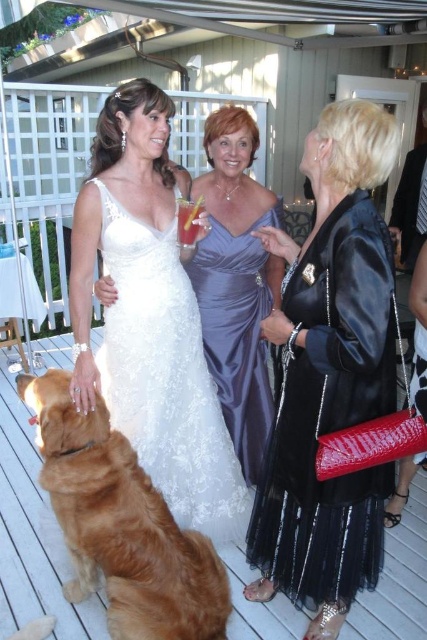
Is black satin clutch at lower right to the right of white lace dress at center from the viewer's perspective?

Yes, black satin clutch at lower right is to the right of white lace dress at center.

Which is more to the right, black satin clutch at lower right or white lace dress at center?

black satin clutch at lower right

Does point (345, 326) lie in front of point (216, 470)?

Yes, it is in front of point (216, 470).

Find the location of a particular element. The image size is (427, 640). black satin clutch at lower right is located at coordinates (328, 376).

Which is above, golden fur dog at lower left or translucent glass at center?

translucent glass at center is above.

Does golden fur dog at lower left appear on the right side of translucent glass at center?

In fact, golden fur dog at lower left is to the left of translucent glass at center.

Which is in front, point (169, 593) or point (187, 200)?

Point (169, 593) is in front.

Identify the location of golden fur dog at lower left. (122, 524).

Can you confirm if white lace dress at center is positioned above satin dress at center?

Incorrect, white lace dress at center is not positioned above satin dress at center.

Is white lace dress at center in front of satin dress at center?

Yes.

Is point (195, 330) farther from camera compared to point (201, 291)?

No, it is not.

Locate an element on the screen. The width and height of the screenshot is (427, 640). white lace dress at center is located at coordinates (166, 376).